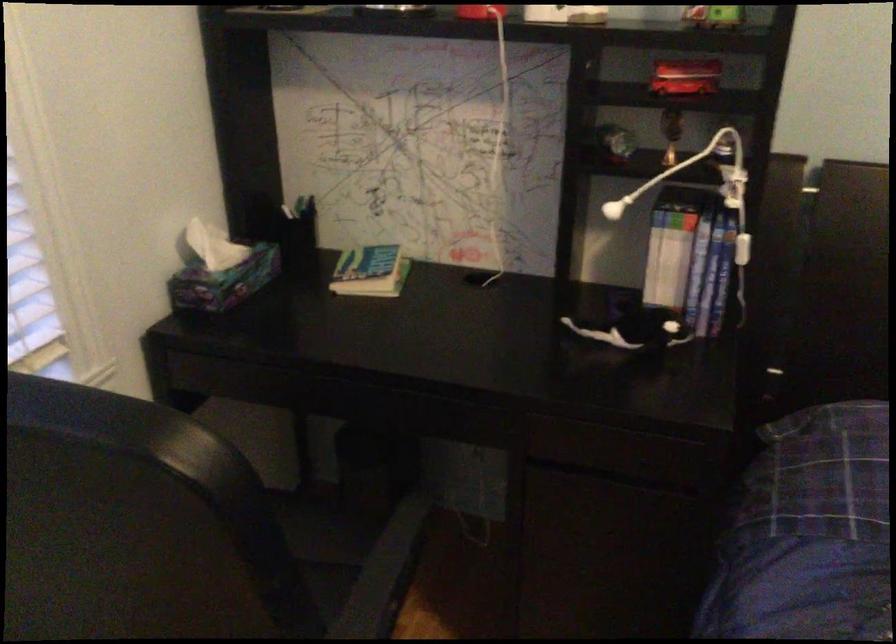
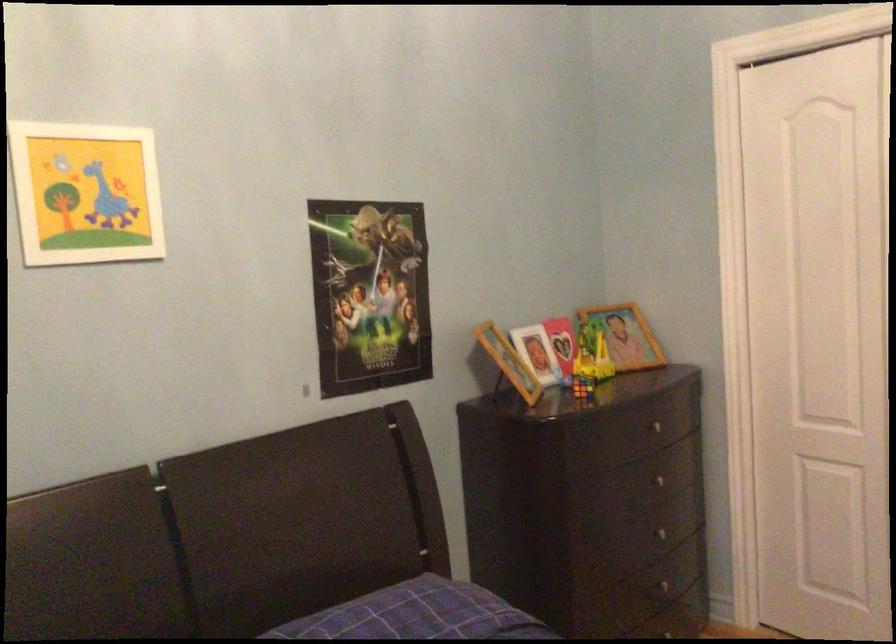
Question: The camera is either moving clockwise (left) or counter-clockwise (right) around the object. The first image is from the beginning of the video and the second image is from the end. Is the camera moving left or right when shooting the video?

Choices:
 (A) Left
 (B) Right

Answer: (A)